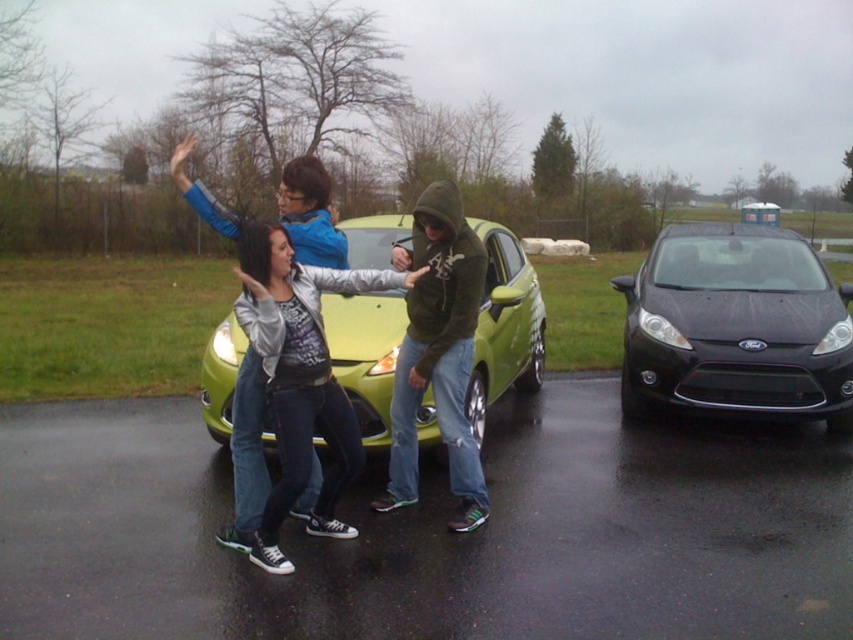
You are a delivery person needing to load a package into the trunk of the green matte hatchback at center. The package is as wide as the denim jacket at center. Will the package fit in the trunk?

The green matte hatchback at center has a lesser width compared to the denim jacket at center. Since the package is as wide as the denim jacket at center, it will not fit in the trunk of the green matte hatchback at center due to insufficient width.

You are a delivery driver who needs to park your van between the black matte ford fiesta at center and the green matte hatchback at center. Considering their heights, which car should you park closer to to ensure your van doesn

The black matte ford fiesta at center is shorter than the green matte hatchback at center. Therefore, to park closer to the shorter car for better visibility and clearance, you should position your van near the black matte ford fiesta at center.

You are a photographer trying to capture a photo of the black matte ford fiesta at center and the dark green hoodie at center. Which object should you zoom in on to make them appear the same size in the photo?

The black matte ford fiesta at center is smaller than the dark green hoodie at center, so you should zoom in on the black matte ford fiesta at center to make them appear the same size in the photo.